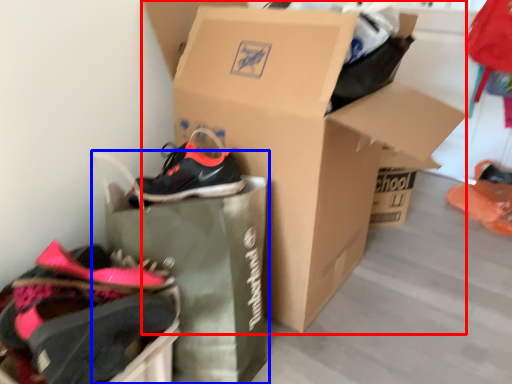
Question: Among these objects, which one is nearest to the camera, box (highlighted by a red box) or shopping bag (highlighted by a blue box)?

Choices:
 (A) box
 (B) shopping bag

Answer: (B)